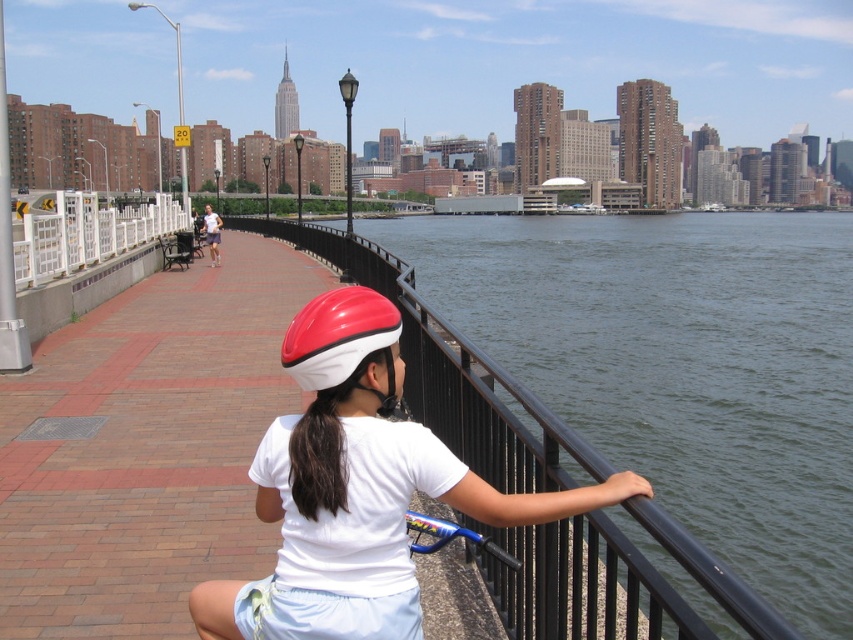
From the picture: You are a photographer trying to capture the reflection of the shiny plastic helmet at center in the dark green water at center. Based on the scene, can you confirm if the reflection will be visible?

The dark green water at center has a greater height compared to the shiny plastic helmet at center, so the reflection of the shiny plastic helmet at center will be visible in the dark green water at center.

You are a delivery person who needs to pick up a shiny plastic helmet located at point (370, 460). The scene has a paved brick pathway with a black metal railing. There is a person sitting on a bicycle near the railing. Can you safely reach the helmet without crossing the pathway?

The shiny plastic helmet at center is located at point (370, 460). Since the person is sitting on a bicycle near the railing and the pathway is paved, you can safely reach the helmet by approaching along the pathway without needing to cross it.